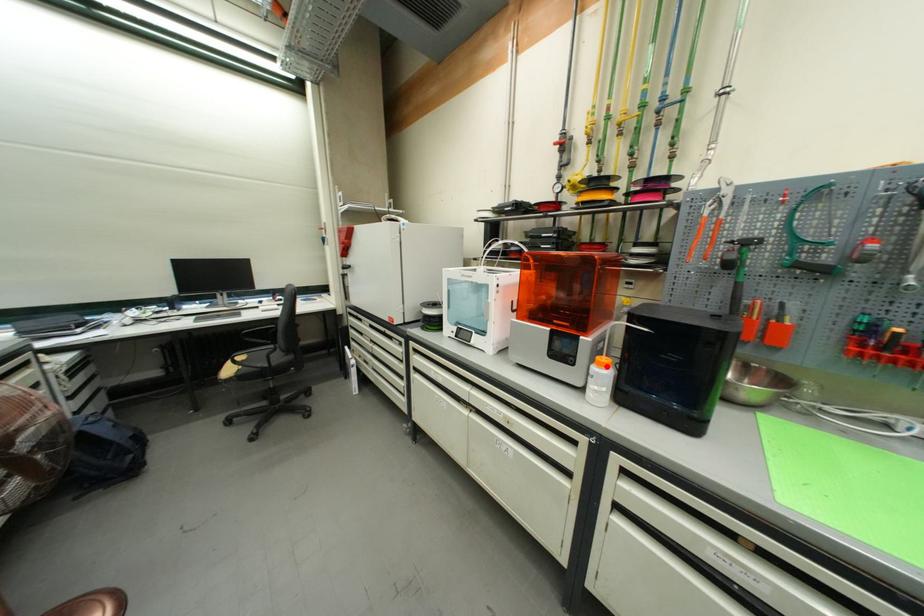
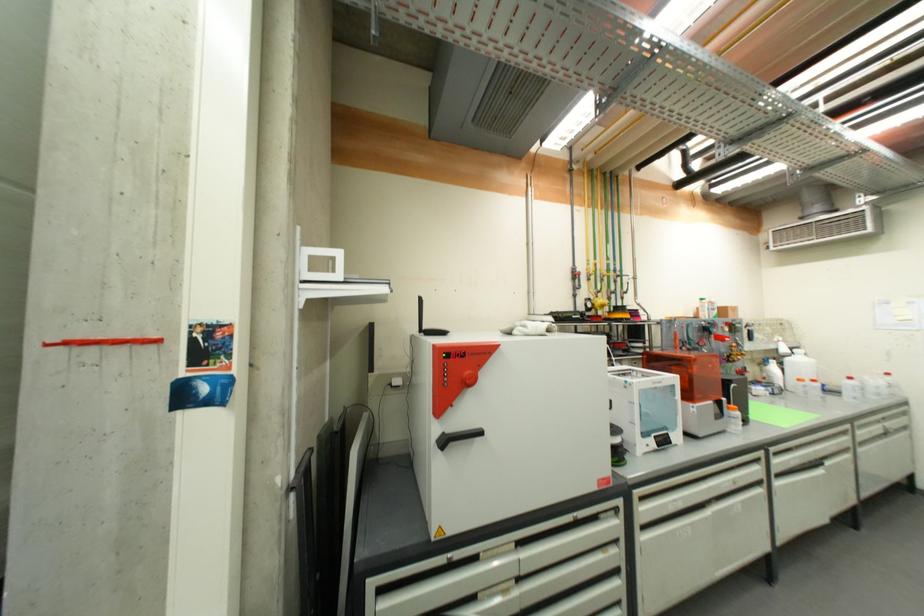
Locate, in the second image, the point that corresponds to the highlighted location in the first image.

(739, 411)